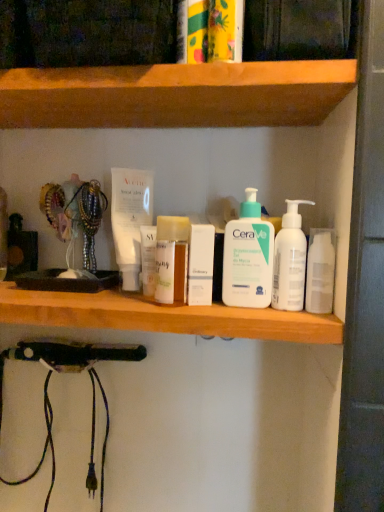
Where is `vacant point to the left of white matte box at center`? vacant point to the left of white matte box at center is located at coordinates (108, 298).